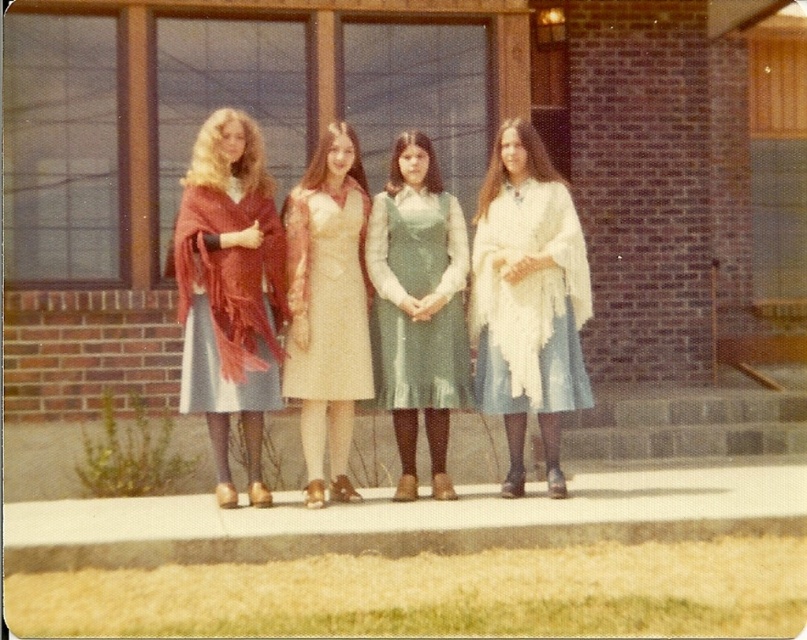
Does matte red shawl at left have a greater width compared to green satin dress at center?

Yes, matte red shawl at left is wider than green satin dress at center.

Does matte red shawl at left lie in front of green satin dress at center?

Yes, it is.

Between point (220, 124) and point (383, 376), which one is positioned in front?

Point (220, 124)

This screenshot has height=640, width=807. Find the location of `matte red shawl at left`. matte red shawl at left is located at coordinates (228, 291).

Which is below, matte red shawl at left or white fringed shawl at right?

matte red shawl at left

Looking at this image, does matte red shawl at left have a larger size compared to white fringed shawl at right?

Incorrect, matte red shawl at left is not larger than white fringed shawl at right.

Where is `matte red shawl at left`? Image resolution: width=807 pixels, height=640 pixels. matte red shawl at left is located at coordinates (228, 291).

This screenshot has width=807, height=640. Find the location of `matte red shawl at left`. matte red shawl at left is located at coordinates pyautogui.click(x=228, y=291).

Is matte red shawl at left bigger than satin beige dress at center?

Yes, matte red shawl at left is bigger than satin beige dress at center.

Does point (254, 168) lie in front of point (360, 340)?

No, it is behind (360, 340).

Between point (235, 312) and point (349, 257), which one is positioned in front?

Point (235, 312)

Image resolution: width=807 pixels, height=640 pixels. What are the coordinates of `matte red shawl at left` in the screenshot? It's located at (228, 291).